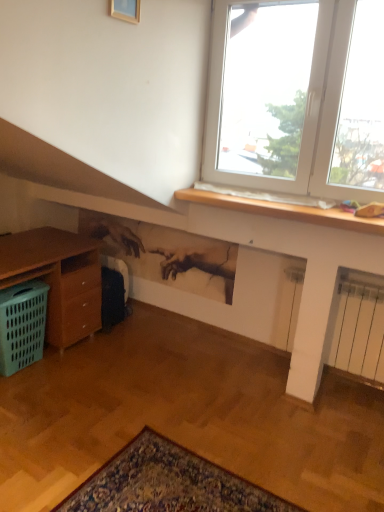
Question: Is gold wooden picture frame at upper center inside the boundaries of green plastic basket at lower left, or outside?

Choices:
 (A) inside
 (B) outside

Answer: (B)

Question: Looking at the image, does gold wooden picture frame at upper center seem bigger or smaller compared to green plastic basket at lower left?

Choices:
 (A) big
 (B) small

Answer: (B)

Question: Considering their positions, is gold wooden picture frame at upper center located in front of or behind green plastic basket at lower left?

Choices:
 (A) behind
 (B) front

Answer: (B)

Question: Based on their sizes in the image, would you say green plastic basket at lower left is bigger or smaller than gold wooden picture frame at upper center?

Choices:
 (A) big
 (B) small

Answer: (A)

Question: From the image's perspective, is green plastic basket at lower left positioned above or below gold wooden picture frame at upper center?

Choices:
 (A) below
 (B) above

Answer: (A)

Question: From their relative heights in the image, would you say green plastic basket at lower left is taller or shorter than gold wooden picture frame at upper center?

Choices:
 (A) short
 (B) tall

Answer: (B)

Question: Considering the positions of point (28, 286) and point (120, 13), is point (28, 286) closer or farther from the camera than point (120, 13)?

Choices:
 (A) closer
 (B) farther

Answer: (B)